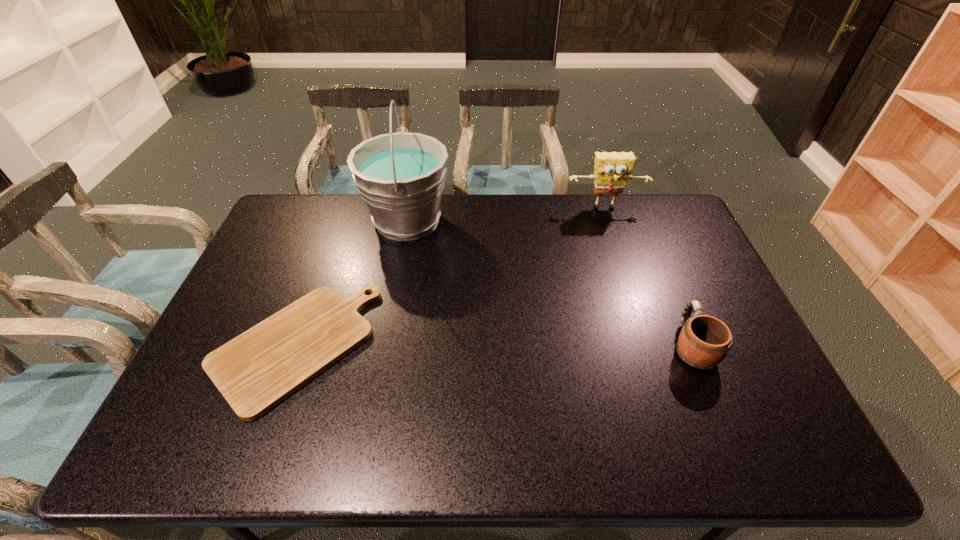
You are a GUI agent. You are given a task and a screenshot of the screen. Output one action in this format:
    pyautogui.click(x=<x>, y=<y>)
    Task: Click on the tallest object
    This screenshot has height=540, width=960.
    Given the screenshot: What is the action you would take?
    pyautogui.click(x=400, y=176)

The width and height of the screenshot is (960, 540). I want to click on sponge, so click(612, 170).

Find the location of a particular element. mug is located at coordinates (704, 340).

The height and width of the screenshot is (540, 960). I want to click on chopping board, so click(x=260, y=368).

Find the location of `vacant region located 0.350m on the right of the tallest object`. vacant region located 0.350m on the right of the tallest object is located at coordinates (550, 221).

At what (x,y) coordinates should I click in order to perform the action: click on vacant area located on the face of the second tallest object. Please return your answer as a coordinate pair (x, y). The height and width of the screenshot is (540, 960). Looking at the image, I should click on (629, 279).

This screenshot has height=540, width=960. Find the location of `free location located on the side of the mug with the handle`. free location located on the side of the mug with the handle is located at coordinates (647, 238).

I want to click on vacant space positioned on the side of the mug with the handle, so click(670, 294).

In order to click on vacant space situated 0.330m on the side of the mug with the handle in this screenshot , I will do `click(650, 244)`.

I want to click on blank area located on the right of the chopping board, so click(x=389, y=347).